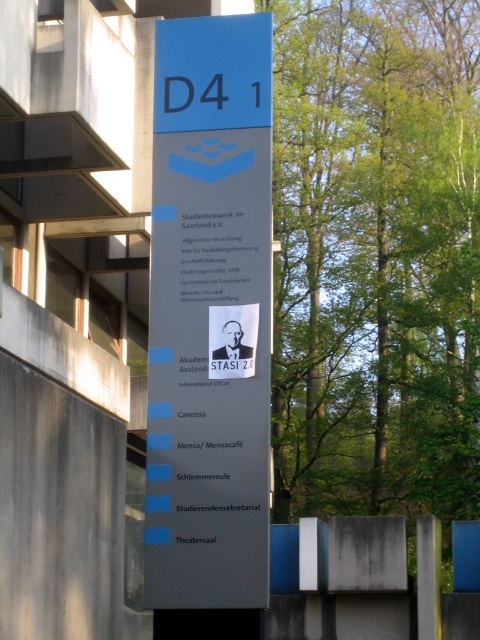
From the picture: You are standing in front of a signpost near a university. You need to find the location of the Mensa. According to the blue plastic sign at center, where is the Mensa located?

The blue plastic sign at center lists the location of the Mensa under the entry for Mensa, which is part of the services listed below the main heading D4 1. The exact coordinates of the sign are at point (x=210, y=316), but the sign itself indicates the direction or location of the Mensa through its text entries.

You are a student at the university and need to find the location of the Mensa. You see a blue plastic sign at center and a black paper at center. Which object is larger and can provide more detailed information?

The blue plastic sign at center is bigger than the black paper at center, so it likely provides more detailed information about the Mensa location.